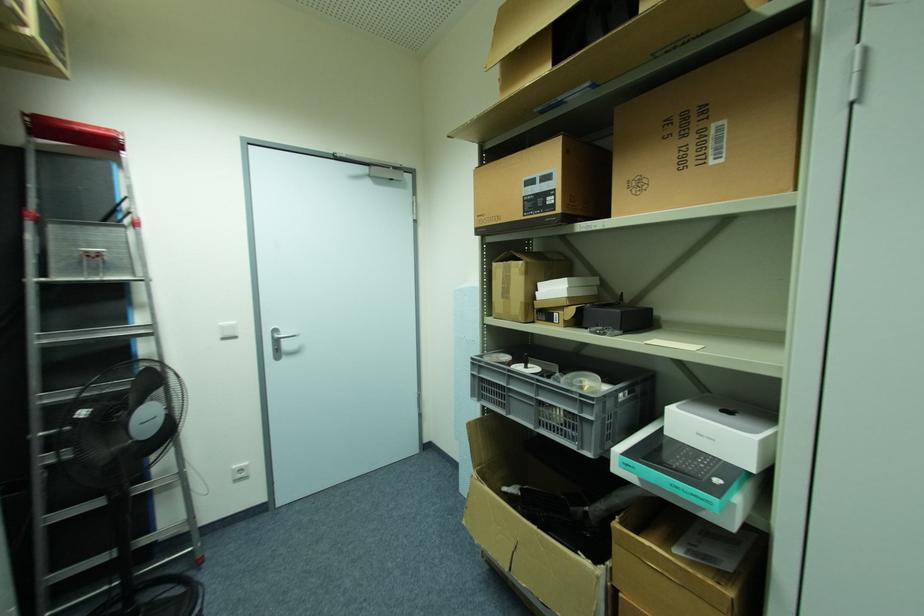
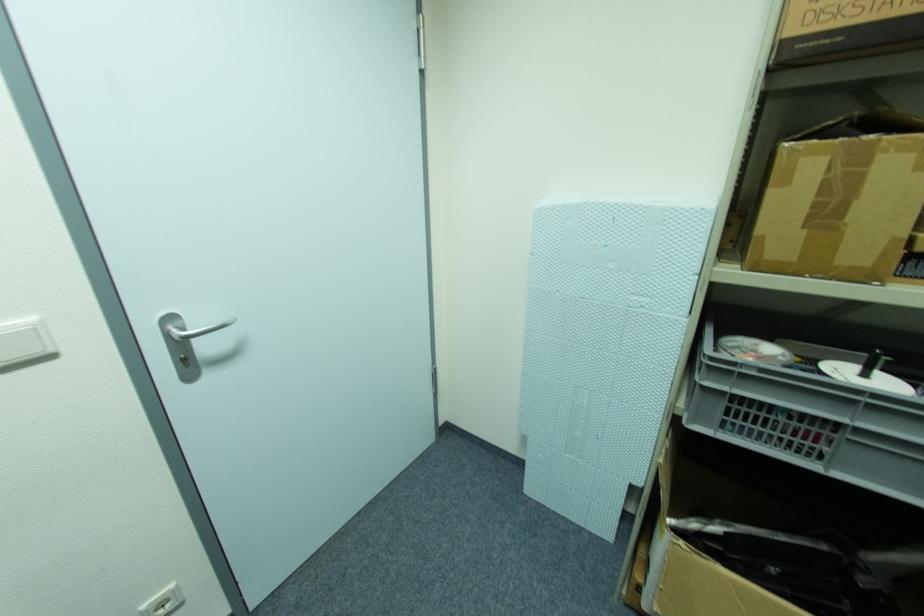
Locate, in the second image, the point that corresponds to point (275, 339) in the first image.

(177, 339)